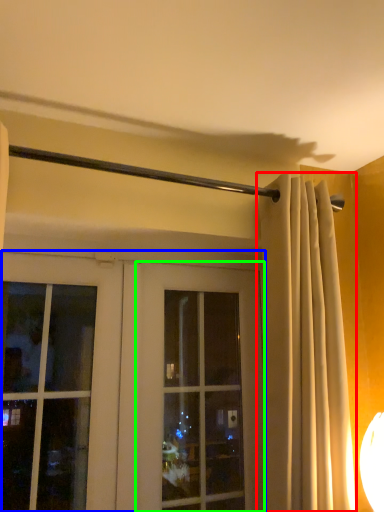
Question: Considering the real-world distances, which object is closest to curtain (highlighted by a red box)? door (highlighted by a blue box) or window (highlighted by a green box).

Choices:
 (A) door
 (B) window

Answer: (B)